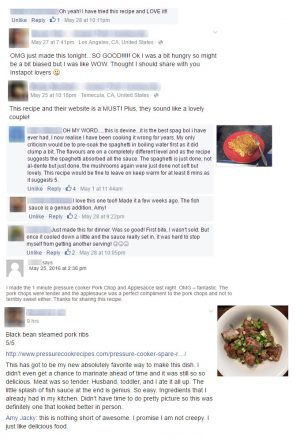
Where is `spoon`? This screenshot has width=300, height=439. spoon is located at coordinates (261, 151).